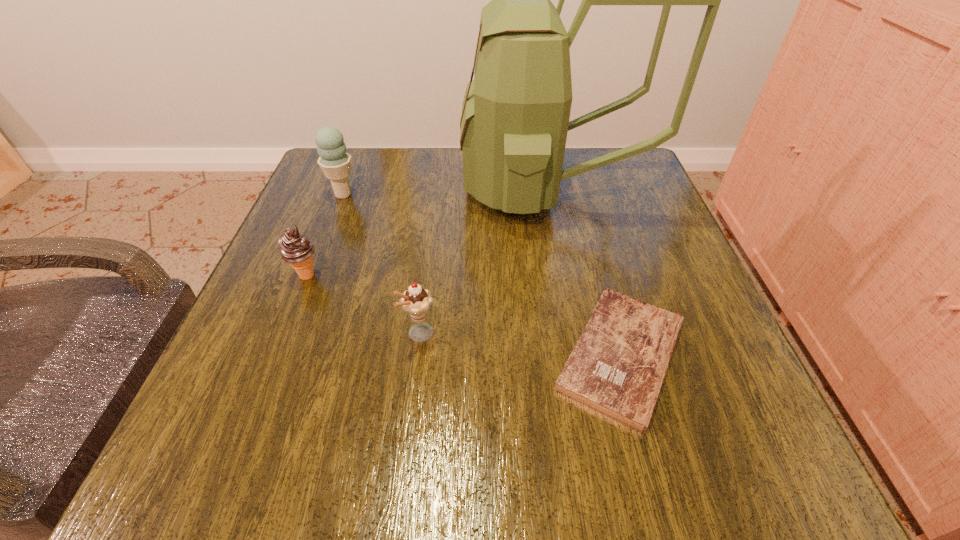
Identify the location of vacant point located 0.100m on the back of the farthest icecream. (355, 163).

I want to click on free region located on the back of the rightmost icecream, so click(x=432, y=245).

This screenshot has width=960, height=540. Identify the location of blank space located 0.230m on the right of the third farthest object. (448, 276).

At what (x,y) coordinates should I click in order to perform the action: click on vacant area located on the back of the Bible. Please return your answer as a coordinate pair (x, y). Looking at the image, I should click on (575, 186).

Find the location of a particular element. The height and width of the screenshot is (540, 960). backpack present at the far edge is located at coordinates (515, 116).

I want to click on ice cream that is positioned at the far edge, so click(335, 162).

Locate an element on the screen. This screenshot has width=960, height=540. object positioned at the near edge is located at coordinates (617, 367).

Where is `backpack that is at the right edge`? The height and width of the screenshot is (540, 960). backpack that is at the right edge is located at coordinates click(515, 116).

Where is `Bible that is at the right edge`? Image resolution: width=960 pixels, height=540 pixels. Bible that is at the right edge is located at coordinates (617, 367).

You are a GUI agent. You are given a task and a screenshot of the screen. Output one action in this format:
    pyautogui.click(x=<x>, y=<y>)
    Task: Click on the object that is positioned at the far left corner
    The width and height of the screenshot is (960, 540).
    Given the screenshot: What is the action you would take?
    pyautogui.click(x=335, y=162)